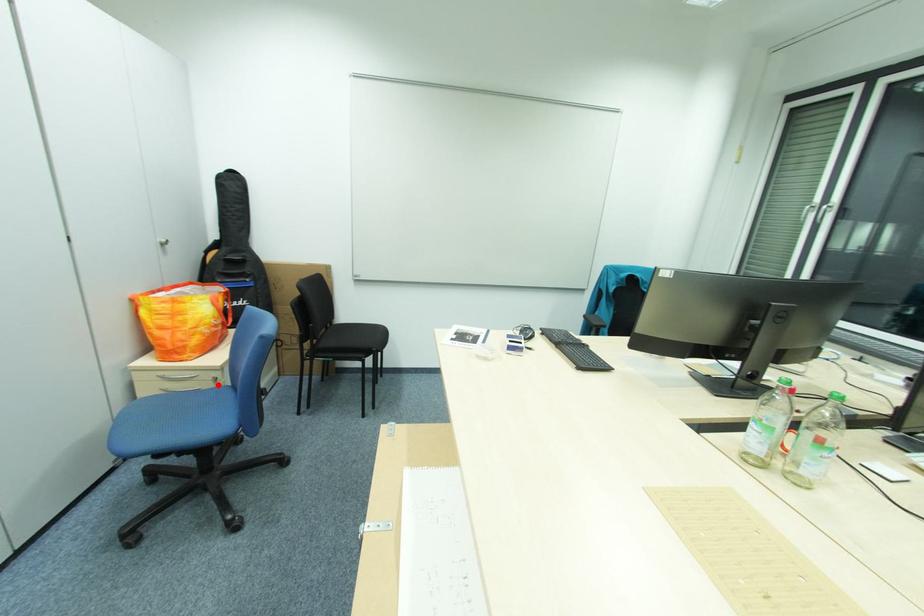
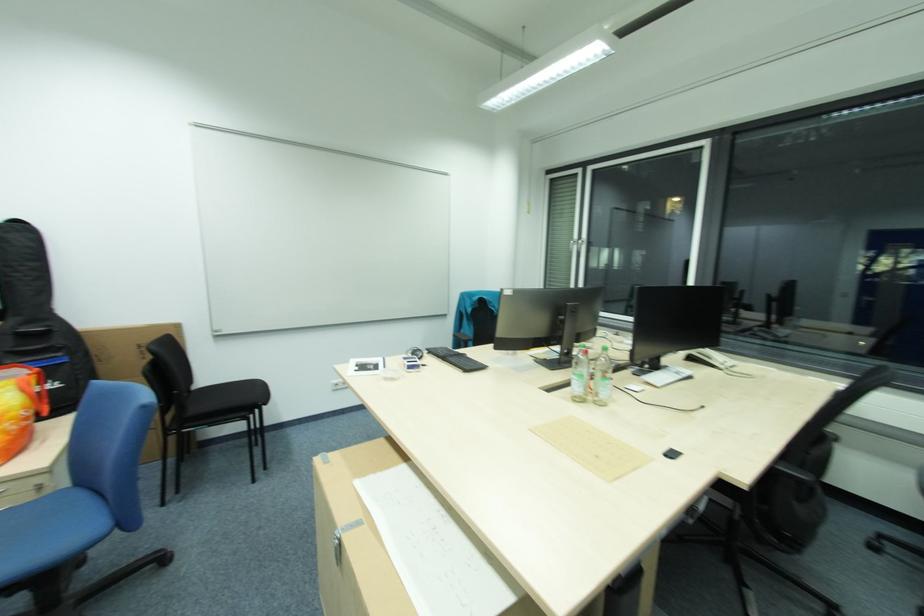
Where in the second image is the point corresponding to the highlighted location from the first image?

(37, 498)